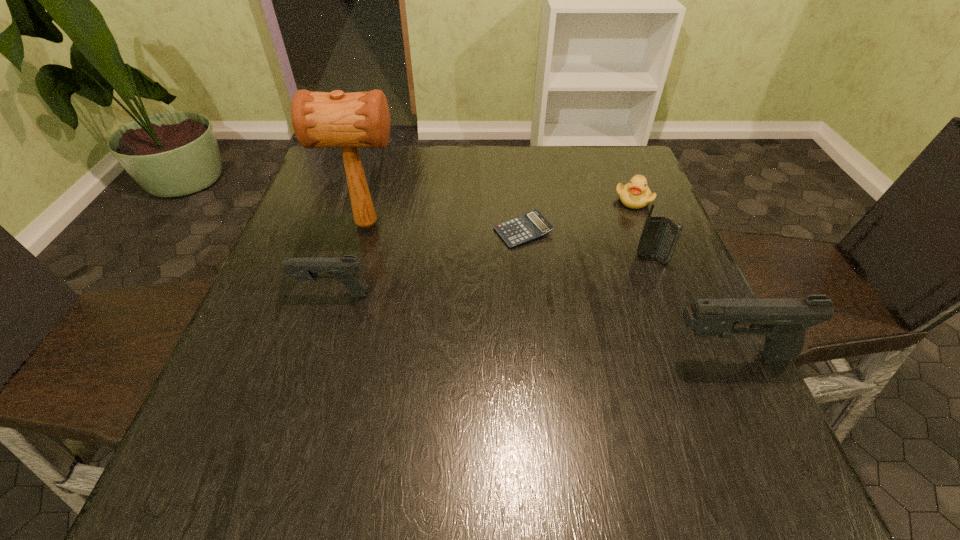
The height and width of the screenshot is (540, 960). What are the coordinates of `free point between the second shortest object and the third nearest object` in the screenshot? It's located at (642, 230).

Where is `free space that is in between the third shortest object and the duckling`? This screenshot has height=540, width=960. free space that is in between the third shortest object and the duckling is located at coordinates (483, 247).

Locate an element on the screen. The image size is (960, 540). free space that is in between the nearer pistol and the duckling is located at coordinates (682, 278).

The width and height of the screenshot is (960, 540). I want to click on free spot between the cellular telephone and the duckling, so click(x=642, y=230).

Where is `free space that is in between the shortest object and the mallet`? The width and height of the screenshot is (960, 540). free space that is in between the shortest object and the mallet is located at coordinates (445, 227).

This screenshot has height=540, width=960. I want to click on the second closest object relative to the duckling, so click(x=531, y=225).

Where is `object that is the fourth closest to the duckling`? This screenshot has width=960, height=540. object that is the fourth closest to the duckling is located at coordinates pos(320,119).

Where is `free space that satisfies the following two spatial constraints: 1. on the back side of the fourth object from right to left; 2. on the strike surface of the tallest object`? The height and width of the screenshot is (540, 960). free space that satisfies the following two spatial constraints: 1. on the back side of the fourth object from right to left; 2. on the strike surface of the tallest object is located at coordinates (522, 224).

Find the location of `free location that satisfies the following two spatial constraints: 1. on the beak of the duckling; 2. on the strike surface of the tallest object`. free location that satisfies the following two spatial constraints: 1. on the beak of the duckling; 2. on the strike surface of the tallest object is located at coordinates (643, 224).